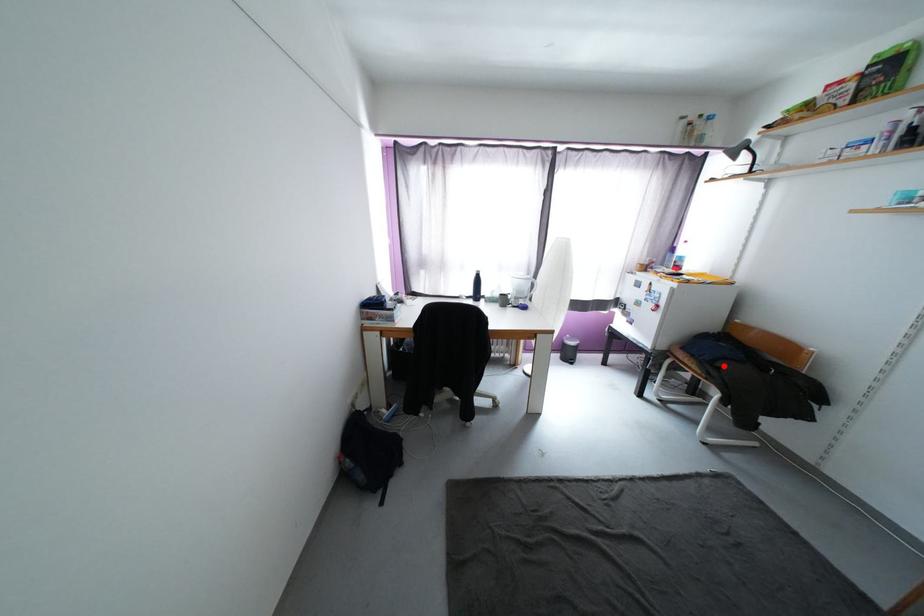
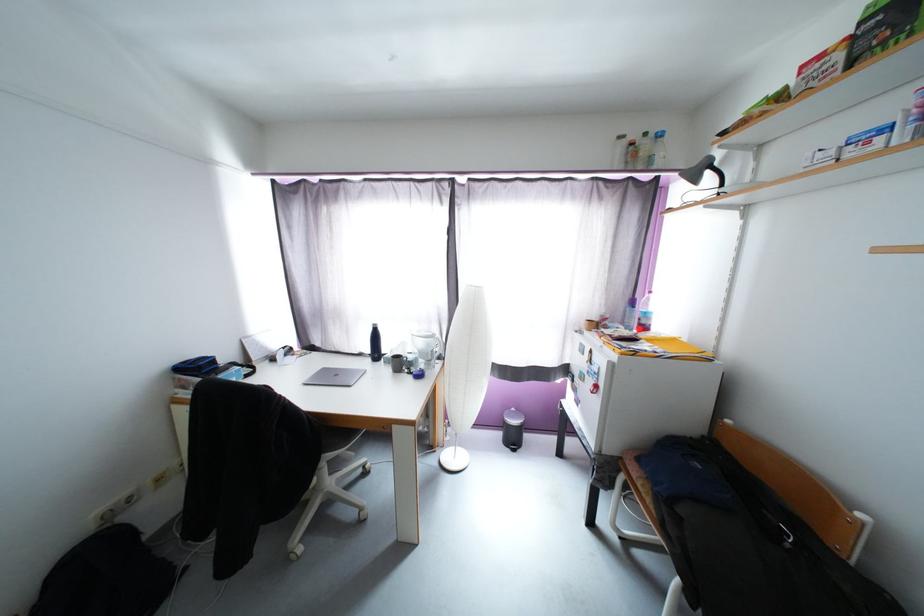
Where in the second image is the point corresponding to the highlighted location from the first image?

(687, 512)